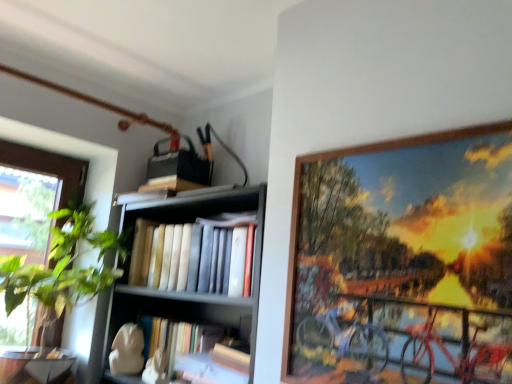
Question: Is wooden picture frame at upper right positioned with its back to hardcover books at center?

Choices:
 (A) no
 (B) yes

Answer: (A)

Question: From the image's perspective, is wooden picture frame at upper right beneath hardcover books at center?

Choices:
 (A) no
 (B) yes

Answer: (A)

Question: From the image's perspective, is wooden picture frame at upper right on top of hardcover books at center?

Choices:
 (A) yes
 (B) no

Answer: (A)

Question: Is wooden picture frame at upper right at the right side of hardcover books at center?

Choices:
 (A) yes
 (B) no

Answer: (A)

Question: Does wooden picture frame at upper right appear on the left side of hardcover books at center?

Choices:
 (A) no
 (B) yes

Answer: (A)

Question: In the image, is hardcover books at center positioned in front of or behind wooden picture frame at upper right?

Choices:
 (A) front
 (B) behind

Answer: (B)

Question: Based on their positions, is hardcover books at center located to the left or right of wooden picture frame at upper right?

Choices:
 (A) right
 (B) left

Answer: (B)

Question: Looking at the image, does hardcover books at center seem bigger or smaller compared to wooden picture frame at upper right?

Choices:
 (A) big
 (B) small

Answer: (A)

Question: From the image's perspective, is hardcover books at center positioned above or below wooden picture frame at upper right?

Choices:
 (A) below
 (B) above

Answer: (A)

Question: Is wooden bookshelf at center in front of or behind hardcover books at center in the image?

Choices:
 (A) front
 (B) behind

Answer: (A)

Question: From a real-world perspective, relative to hardcover books at center, is wooden bookshelf at center vertically above or below?

Choices:
 (A) above
 (B) below

Answer: (B)

Question: From the image's perspective, is wooden bookshelf at center located above or below hardcover books at center?

Choices:
 (A) above
 (B) below

Answer: (B)

Question: Considering the positions of point (168, 261) and point (200, 259), is point (168, 261) closer or farther from the camera than point (200, 259)?

Choices:
 (A) closer
 (B) farther

Answer: (B)

Question: Considering the relative positions of wooden bookshelf at center and green leafy plant at left in the image provided, is wooden bookshelf at center to the left or to the right of green leafy plant at left?

Choices:
 (A) right
 (B) left

Answer: (A)

Question: Is wooden bookshelf at center in front of or behind green leafy plant at left in the image?

Choices:
 (A) front
 (B) behind

Answer: (A)